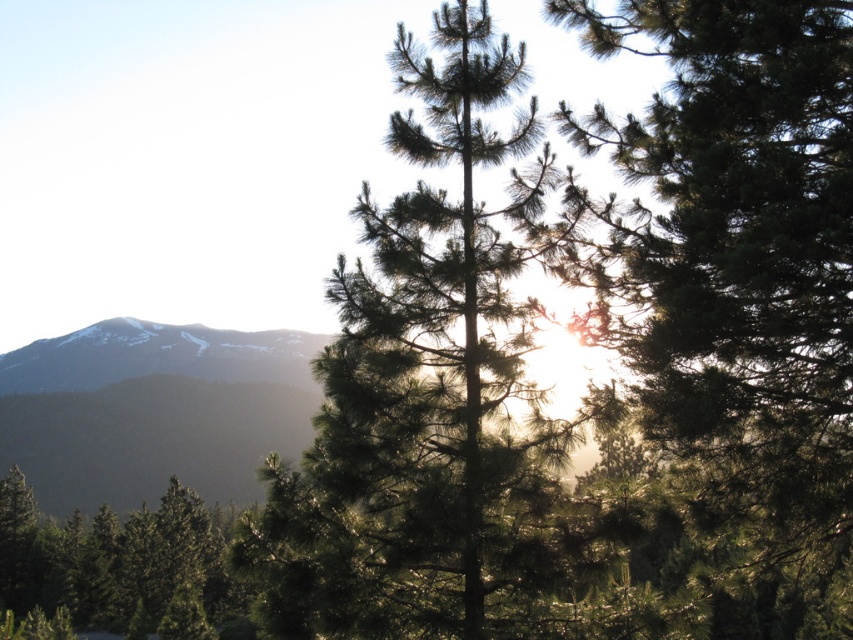
Between green needle-like tree at center and green matte tree at lower left, which one has less height?

Standing shorter between the two is green needle-like tree at center.

Image resolution: width=853 pixels, height=640 pixels. What are the coordinates of `green needle-like tree at center` in the screenshot? It's located at (741, 260).

Is point (761, 380) positioned behind point (21, 477)?

No, it is not.

Locate an element on the screen. The image size is (853, 640). green needle-like tree at center is located at coordinates (741, 260).

Which is in front, point (763, 374) or point (83, 504)?

Point (763, 374) is in front.

Locate an element on the screen. green needle-like tree at center is located at coordinates (741, 260).

Does green needle-like at center come in front of green matte tree at lower left?

Yes.

Does point (457, 621) lie in front of point (82, 540)?

Yes, it is in front of point (82, 540).

Locate an element on the screen. green needle-like at center is located at coordinates (431, 396).

This screenshot has width=853, height=640. In order to click on green needle-like at center in this screenshot , I will do `click(431, 396)`.